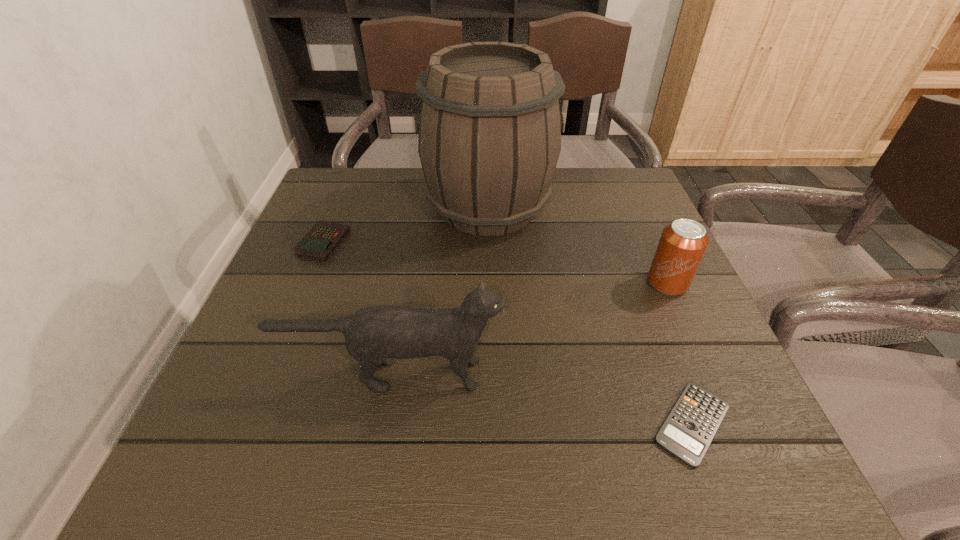
This screenshot has height=540, width=960. In the image, there is a desktop. Identify the location of vacant area at the far edge. (555, 198).

Where is `vacant point at the near edge`? Image resolution: width=960 pixels, height=540 pixels. vacant point at the near edge is located at coordinates (356, 465).

Locate an element on the screen. The height and width of the screenshot is (540, 960). vacant region at the left edge of the desktop is located at coordinates (315, 381).

Locate an element on the screen. free space at the far left corner of the desktop is located at coordinates (329, 215).

This screenshot has width=960, height=540. Find the location of `free space at the near left corner of the desktop`. free space at the near left corner of the desktop is located at coordinates (231, 464).

Identify the location of vacant area between the can and the second tallest object. (530, 329).

This screenshot has width=960, height=540. I want to click on free area in between the cat and the taller calculator, so click(x=357, y=308).

Find the location of `free space between the left calculator and the tallest object`. free space between the left calculator and the tallest object is located at coordinates (406, 225).

Where is `vacant space that is in between the nearer calculator and the cat`? The image size is (960, 540). vacant space that is in between the nearer calculator and the cat is located at coordinates (542, 399).

The height and width of the screenshot is (540, 960). What are the coordinates of `free space between the shorter calculator and the second tallest object` in the screenshot? It's located at (542, 399).